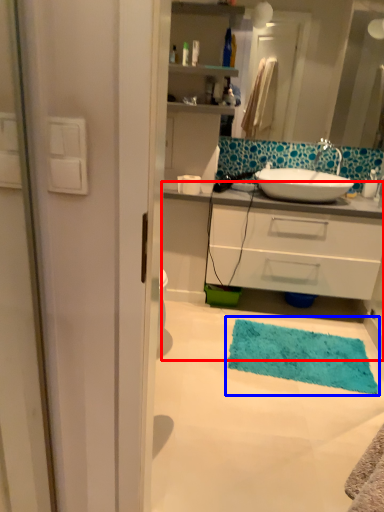
Question: Among these objects, which one is farthest to the camera, bathroom cabinet (highlighted by a red box) or bath mat (highlighted by a blue box)?

Choices:
 (A) bathroom cabinet
 (B) bath mat

Answer: (A)